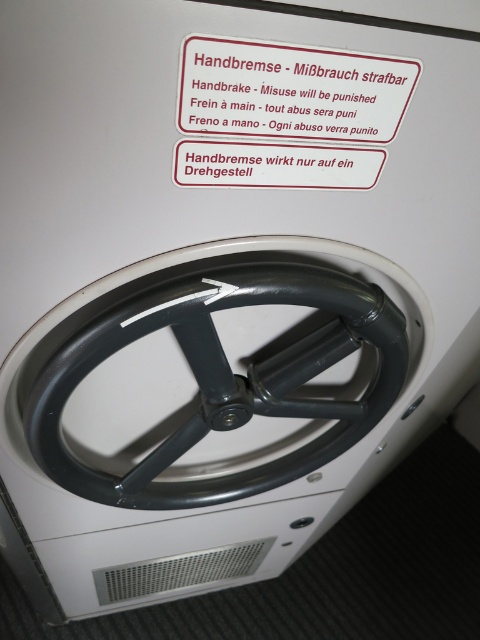
Between black matte steering wheel at center and white plastic sign at upper center, which one is positioned higher?

Positioned higher is white plastic sign at upper center.

At what (x,y) coordinates should I click in order to perform the action: click on black matte steering wheel at center. Please return your answer as a coordinate pair (x, y). The image size is (480, 640). Looking at the image, I should click on [x=226, y=378].

I want to click on black matte steering wheel at center, so click(226, 378).

I want to click on black matte steering wheel at center, so click(x=226, y=378).

Describe the element at coordinates (286, 113) in the screenshot. I see `white plastic sign at upper center` at that location.

Which is in front, point (240, 90) or point (240, 109)?

Point (240, 90) is more forward.

Locate an element on the screen. This screenshot has width=480, height=640. white plastic sign at upper center is located at coordinates (286, 113).

Looking at this image, does black matte steering wheel at center have a larger size compared to white paper sticker at upper center?

Indeed, black matte steering wheel at center has a larger size compared to white paper sticker at upper center.

Is point (50, 380) more distant than point (231, 49)?

Yes, point (50, 380) is behind point (231, 49).

Find the location of a particular element. black matte steering wheel at center is located at coordinates (226, 378).